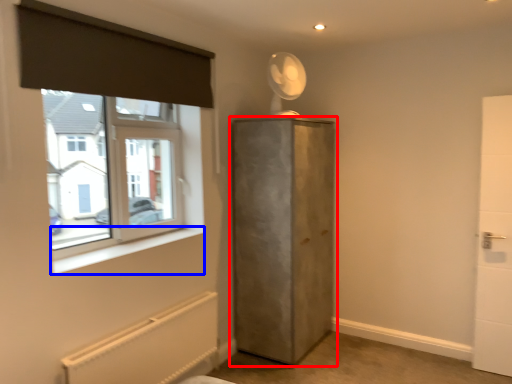
Question: Among these objects, which one is farthest to the camera, door (highlighted by a red box) or window sill (highlighted by a blue box)?

Choices:
 (A) door
 (B) window sill

Answer: (A)